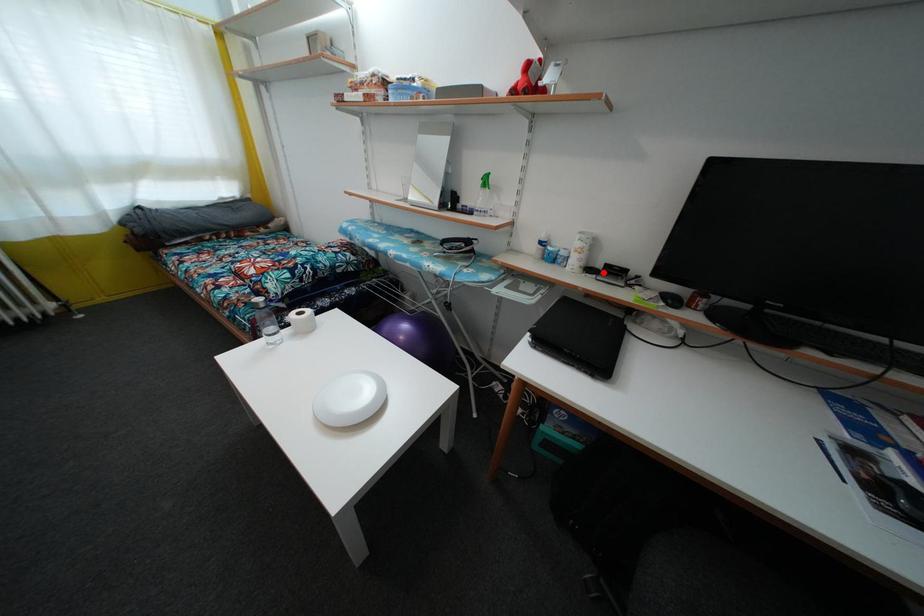
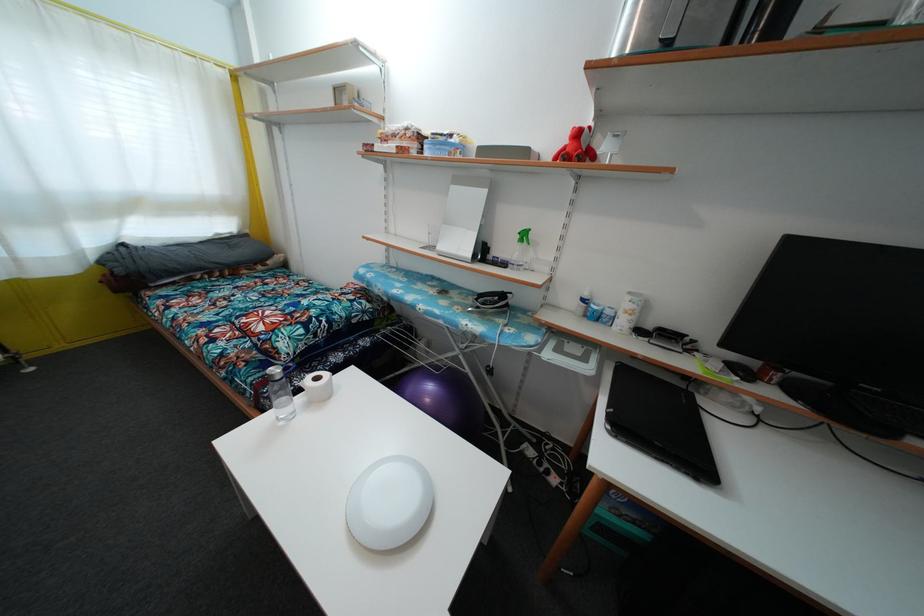
Find the pixel in the second image that matches the highlighted location in the first image.

(652, 334)